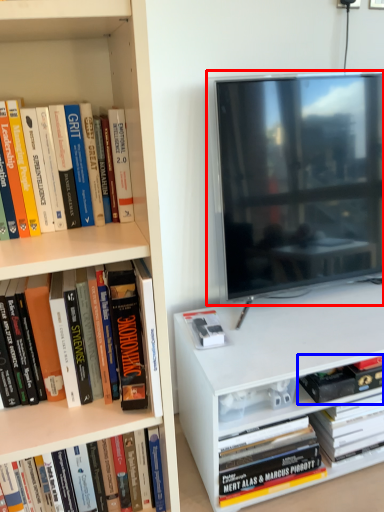
Question: Which point is closer to the camera, television (highlighted by a red box) or book (highlighted by a blue box)?

Choices:
 (A) television
 (B) book

Answer: (A)